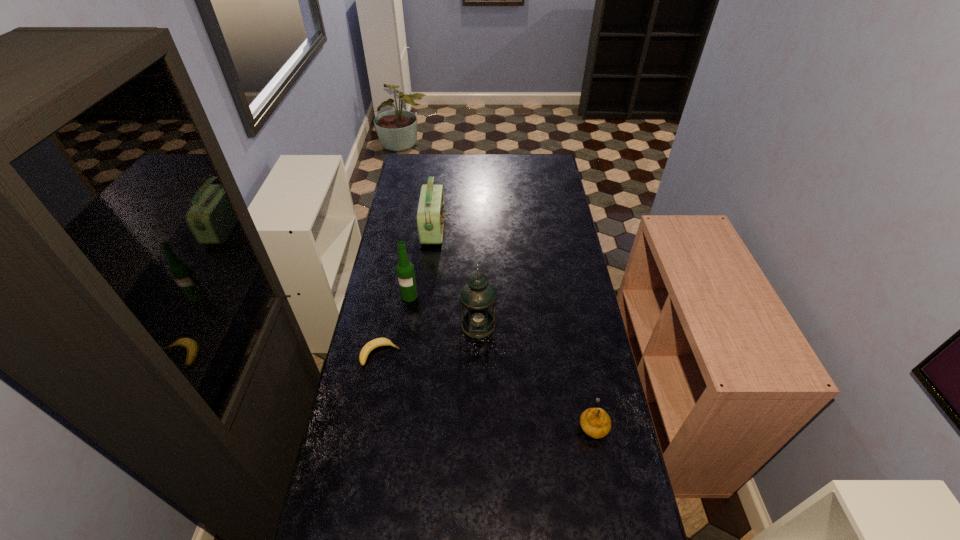
Where is `vacant space at the right edge`? vacant space at the right edge is located at coordinates (553, 302).

Where is `free space at the far left corner`? free space at the far left corner is located at coordinates (410, 158).

Find the location of a particular element. The height and width of the screenshot is (540, 960). free space at the far right corner of the desktop is located at coordinates (547, 172).

Find the location of a particular element. free space between the third nearest object and the farthest object is located at coordinates (456, 277).

Identify the location of free space between the pear and the banana. (486, 389).

At what (x,y) coordinates should I click in order to perform the action: click on vacant space in between the radio receiver and the beer bottle. Please return your answer as a coordinate pair (x, y). Looking at the image, I should click on (421, 262).

Locate an element on the screen. free spot between the fourth nearest object and the shortest object is located at coordinates (x=395, y=325).

Find the location of a particular element. The height and width of the screenshot is (540, 960). vacant space that is in between the third shortest object and the fourth tallest object is located at coordinates (513, 327).

I want to click on free area in between the second shortest object and the second farthest object, so click(x=501, y=360).

The image size is (960, 540). Find the location of `vacant area that lies between the fourth shortest object and the third nearest object`. vacant area that lies between the fourth shortest object and the third nearest object is located at coordinates (444, 310).